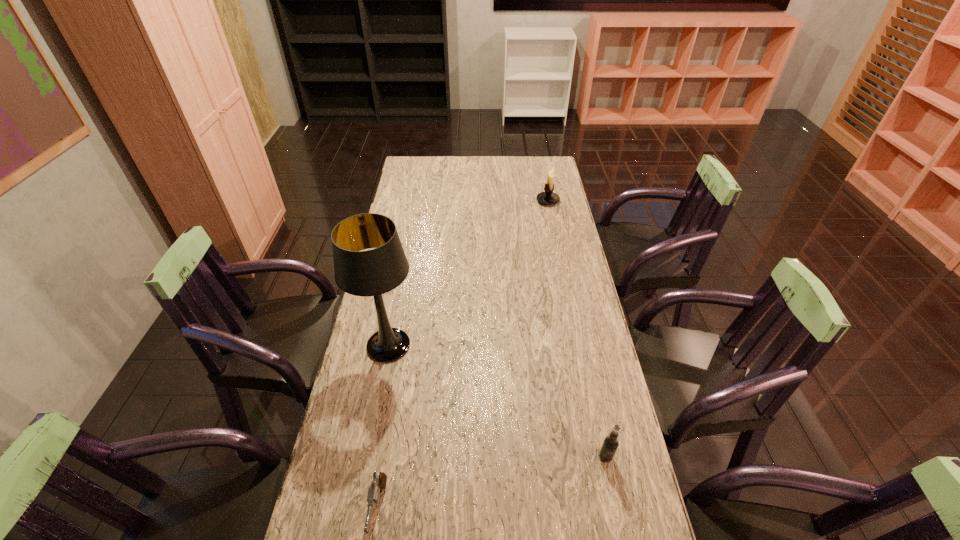
The height and width of the screenshot is (540, 960). In order to click on root beer present at the right edge in this screenshot , I will do `click(610, 443)`.

The image size is (960, 540). I want to click on blank area at the far edge, so (x=496, y=173).

Locate an element on the screen. Image resolution: width=960 pixels, height=540 pixels. blank space at the left edge of the desktop is located at coordinates (404, 246).

You are a GUI agent. You are given a task and a screenshot of the screen. Output one action in this format:
    pyautogui.click(x=<x>, y=<y>)
    Task: Click on the vacant space at the right edge of the desktop
    Image resolution: width=960 pixels, height=540 pixels.
    Given the screenshot: What is the action you would take?
    pyautogui.click(x=594, y=463)

The image size is (960, 540). Find the location of `free spot at the far right corner of the desktop`. free spot at the far right corner of the desktop is located at coordinates (532, 177).

Find the location of a particular element. Image resolution: width=960 pixels, height=540 pixels. empty space between the candle holder and the table lamp is located at coordinates (468, 273).

Where is `free spot between the candle holder and the second nearest object`? The height and width of the screenshot is (540, 960). free spot between the candle holder and the second nearest object is located at coordinates (577, 329).

In order to click on free space between the table lamp and the farthest object in this screenshot , I will do `click(468, 273)`.

This screenshot has width=960, height=540. Find the location of `free space between the candle holder and the tallest object`. free space between the candle holder and the tallest object is located at coordinates (468, 273).

Identify the location of object that stands as the closest to the farthest object. This screenshot has width=960, height=540. (374, 272).